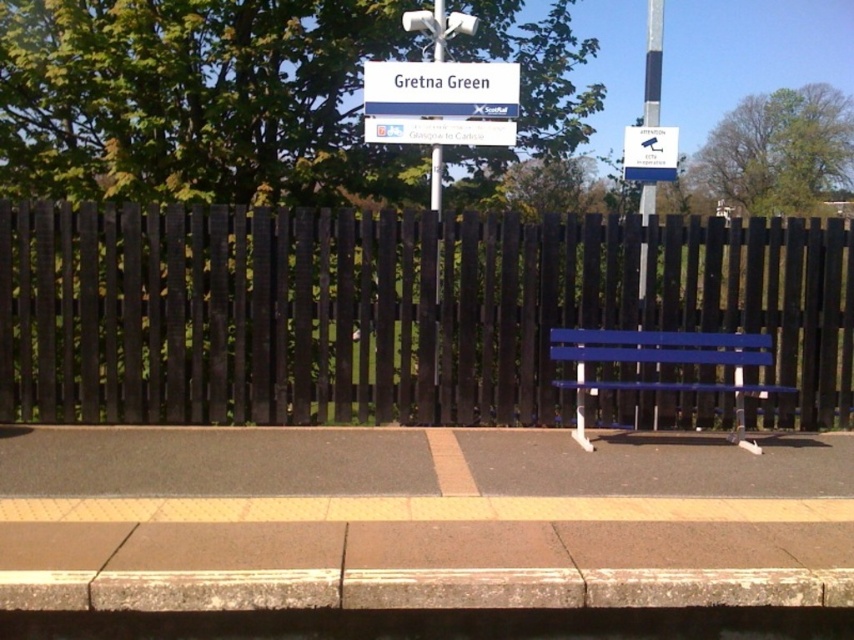
You are a visitor at the Gretna Green railway station and want to sit down. You see the blue painted wood bench at center and the metallic blue sign at center. Which object is taller?

The blue painted wood bench at center is much taller than the metallic blue sign at center.

You are a visitor at Gretna Green railway station and need to find a place to sit. You see a blue painted wood bench at center and a metallic blue sign at center. Which object is larger and can provide seating?

The blue painted wood bench at center is bigger than the metallic blue sign at center, so it can provide seating as it is larger.